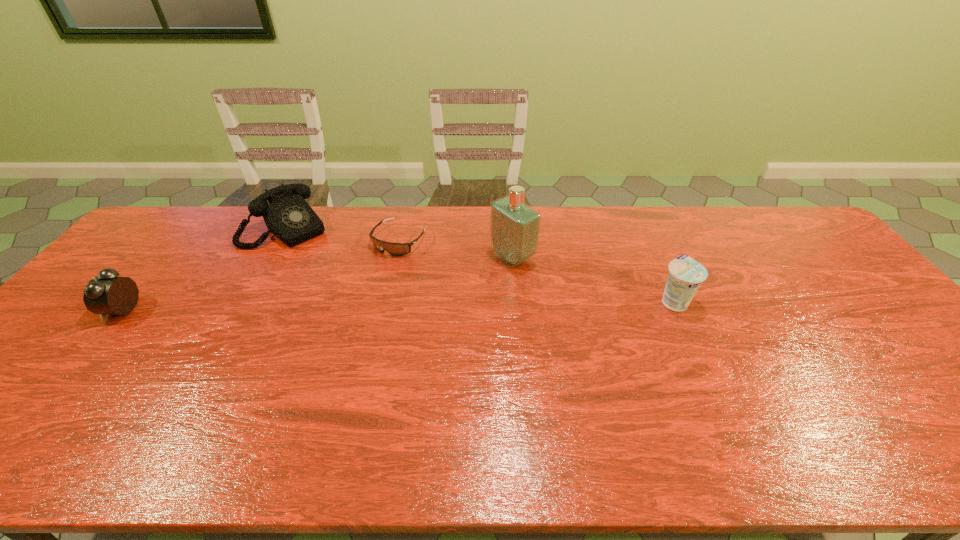
Identify the location of unoccupied area between the yogurt and the shortest object. (537, 271).

Where is `vacant space that's between the yogurt and the fourth object from right to left`? vacant space that's between the yogurt and the fourth object from right to left is located at coordinates (480, 265).

At what (x,y) coordinates should I click in order to perform the action: click on free point between the rightmost object and the third object from left to right. Please return your answer as a coordinate pair (x, y). The height and width of the screenshot is (540, 960). Looking at the image, I should click on (537, 271).

The width and height of the screenshot is (960, 540). Find the location of `unoccupied position between the yogurt and the telephone`. unoccupied position between the yogurt and the telephone is located at coordinates (480, 265).

Find the location of `object that is the second closest one to the rightmost object`. object that is the second closest one to the rightmost object is located at coordinates (395, 249).

Identify which object is located as the fourth nearest to the rightmost object. Please provide its 2D coordinates. Your answer should be formatted as a tuple, i.e. [(x, y)], where the tuple contains the x and y coordinates of a point satisfying the conditions above.

[(106, 294)]

Locate an element on the screen. This screenshot has width=960, height=540. vacant space that satisfies the following two spatial constraints: 1. on the front side of the telephone; 2. on the right side of the goggles is located at coordinates (279, 240).